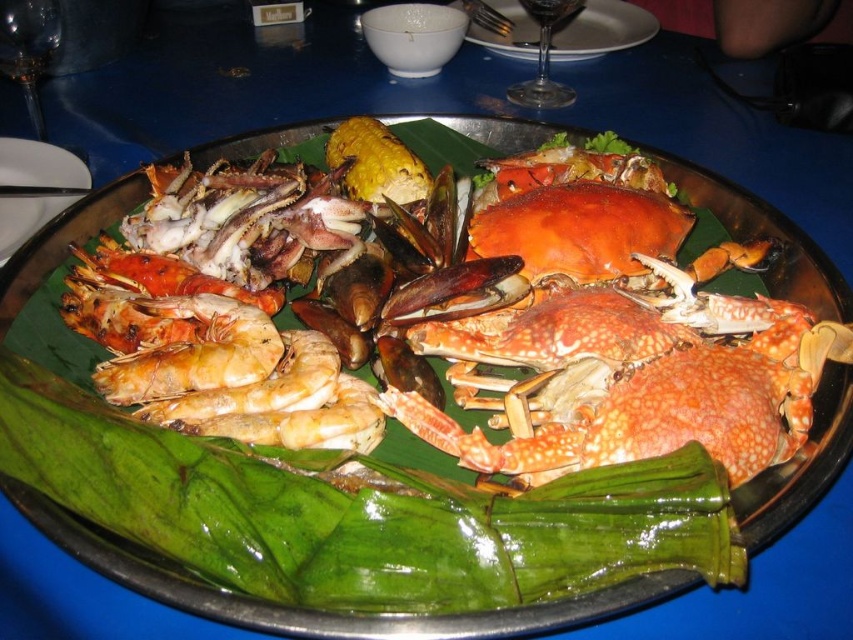
Is point (643, 467) farther from camera compared to point (86, 180)?

No, (643, 467) is in front of (86, 180).

Between green leafy vegetable at center and white glossy plate at upper left, which one has less height?

green leafy vegetable at center

Does point (184, 556) come behind point (83, 176)?

No, it is in front of (83, 176).

I want to click on green leafy vegetable at center, so click(360, 513).

Which is in front, point (265, 404) or point (13, 13)?

Positioned in front is point (265, 404).

Can you confirm if white matte shrimp at center is shorter than transparent glass at upper left?

Yes, white matte shrimp at center is shorter than transparent glass at upper left.

Is point (181, 417) positioned after point (53, 38)?

No, (181, 417) is closer to viewer.

Locate an element on the screen. This screenshot has width=853, height=640. white matte shrimp at center is located at coordinates (258, 387).

Who is more forward, [210,372] or [322,365]?

Point [210,372] is more forward.

This screenshot has width=853, height=640. Describe the element at coordinates (193, 352) in the screenshot. I see `shiny golden prawns at center` at that location.

Locate an element on the screen. The height and width of the screenshot is (640, 853). shiny golden prawns at center is located at coordinates (193, 352).